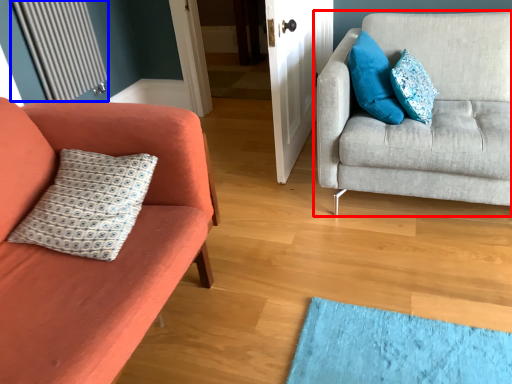
Question: Which of the following is the farthest to the observer, studio couch (highlighted by a red box) or radiator (highlighted by a blue box)?

Choices:
 (A) studio couch
 (B) radiator

Answer: (B)